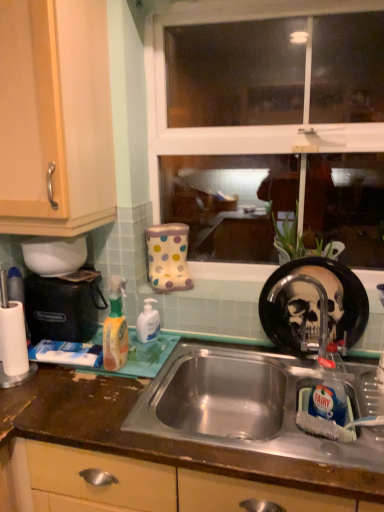
The width and height of the screenshot is (384, 512). Find the location of `brown laminate countertop at center`. brown laminate countertop at center is located at coordinates (177, 442).

What do you see at coordinates (55, 117) in the screenshot?
I see `light wood/finish cabinet at left` at bounding box center [55, 117].

You are a GUI agent. You are given a task and a screenshot of the screen. Output one action in this format:
    pyautogui.click(x=<x>, y=<y>)
    Task: Click on the brown laminate countertop at center
    
    Given the screenshot: What is the action you would take?
    pyautogui.click(x=177, y=442)

In the image, is white matte toothpaste at lower left positioned in front of or behind brown laminate countertop at center?

white matte toothpaste at lower left is positioned farther from the viewer than brown laminate countertop at center.

Between point (99, 364) and point (54, 471), which one is positioned behind?

The point (99, 364) is farther from the camera.

Is white matte toothpaste at lower left at the left side of brown laminate countertop at center?

Yes.

Is white matte toothpaste at lower left not within brown laminate countertop at center?

Absolutely, white matte toothpaste at lower left is external to brown laminate countertop at center.

Is white matte toothpaste at lower left to the left of white glossy hand soap at center, placed as the 2th cleaning product when sorted from front to back, from the viewer's perspective?

Correct, you'll find white matte toothpaste at lower left to the left of white glossy hand soap at center, placed as the 2th cleaning product when sorted from front to back.

Is white matte toothpaste at lower left looking in the opposite direction of white glossy hand soap at center, the first cleaning product from the back?

No.

Which of these two, white matte toothpaste at lower left or white glossy hand soap at center, placed as the second cleaning product when sorted from left to right, is smaller?

Smaller between the two is white glossy hand soap at center, placed as the second cleaning product when sorted from left to right.

Does white matte toothpaste at lower left lie behind white glossy hand soap at center, the first cleaning product from the back?

No, white matte toothpaste at lower left is closer to the viewer.

Is white matte toothpaste at lower left facing towards transparent glass window at center?

No, white matte toothpaste at lower left is not aimed at transparent glass window at center.

Based on the photo, can you confirm if white matte toothpaste at lower left is wider than transparent glass window at center?

Yes, white matte toothpaste at lower left is wider than transparent glass window at center.

Can you confirm if white matte toothpaste at lower left is positioned to the right of transparent glass window at center?

No.

From the image's perspective, between white matte toothpaste at lower left and transparent glass window at center, who is located below?

white matte toothpaste at lower left, from the image's perspective.

Could you measure the distance between translucent orange spray bottle at left, the 1th cleaning product viewed from the front, and brushed metal faucet at sink right?

They are 21.21 inches apart.

Which is closer to the camera, (124,328) or (318,280)?

Point (124,328) is closer to the camera than point (318,280).

From a real-world perspective, is translucent orange spray bottle at left, the second cleaning product in the back-to-front sequence, positioned under brushed metal faucet at sink right based on gravity?

Actually, translucent orange spray bottle at left, the second cleaning product in the back-to-front sequence, is physically above brushed metal faucet at sink right in the real world.

Which object is more forward, translucent orange spray bottle at left, the second cleaning product in the back-to-front sequence, or brushed metal faucet at sink right?

translucent orange spray bottle at left, the second cleaning product in the back-to-front sequence, is more forward.

Is black plastic coffee machine at left wider or thinner than white matte toothpaste at lower left?

black plastic coffee machine at left is thinner than white matte toothpaste at lower left.

Could you tell me if black plastic coffee machine at left is turned towards white matte toothpaste at lower left?

Yes, black plastic coffee machine at left is oriented towards white matte toothpaste at lower left.

Considering the relative positions of black plastic coffee machine at left and white matte toothpaste at lower left in the image provided, is black plastic coffee machine at left to the right of white matte toothpaste at lower left from the viewer's perspective?

No, black plastic coffee machine at left is not to the right of white matte toothpaste at lower left.

Measure the distance between black plastic coffee machine at left and white matte toothpaste at lower left.

They are 4.76 inches apart.

Does brushed metal faucet at sink right come in front of white glossy hand soap at center, placed as the second cleaning product when sorted from left to right?

Yes, brushed metal faucet at sink right is closer to the camera.

Between brushed metal faucet at sink right and white glossy hand soap at center, the first cleaning product from the back, which one has more height?

With more height is brushed metal faucet at sink right.

Can you tell me how much brushed metal faucet at sink right and white glossy hand soap at center, placed as the second cleaning product when sorted from left to right, differ in facing direction?

2.23 degrees separate the facing orientations of brushed metal faucet at sink right and white glossy hand soap at center, placed as the second cleaning product when sorted from left to right.

Considering the relative positions of brushed metal faucet at sink right and white glossy hand soap at center, which is the first cleaning product in right-to-left order, in the image provided, is brushed metal faucet at sink right to the right of white glossy hand soap at center, which is the first cleaning product in right-to-left order, from the viewer's perspective?

Indeed, brushed metal faucet at sink right is positioned on the right side of white glossy hand soap at center, which is the first cleaning product in right-to-left order.

In terms of height, does transparent glass window at center look taller or shorter compared to white matte toothpaste at lower left?

transparent glass window at center is taller than white matte toothpaste at lower left.

Does transparent glass window at center lie in front of white matte toothpaste at lower left?

Yes, it is.

Find the location of a particular element. toothpaste below the transparent glass window at center (from a real-world perspective) is located at coordinates (67, 353).

Image resolution: width=384 pixels, height=512 pixels. What are the coordinates of `toothpaste located above the brown laminate countertop at center (from a real-world perspective)` in the screenshot? It's located at (67, 353).

You are a GUI agent. You are given a task and a screenshot of the screen. Output one action in this format:
    pyautogui.click(x=<x>, y=<y>)
    Task: Click on the cleaning product that is the 1st one when counting upward from the white matte toothpaste at lower left (from the image's perspective)
    Image resolution: width=384 pixels, height=512 pixels.
    Given the screenshot: What is the action you would take?
    pyautogui.click(x=148, y=322)

Estimate the real-world distances between objects in this image. Which object is further from light wood/finish cabinet at left, brushed metal faucet at sink right or black plastic coffee machine at left?

The object further to light wood/finish cabinet at left is brushed metal faucet at sink right.

Based on the photo, looking at the image, which one is located closer to brown laminate countertop at center, white glossy hand soap at center, the first cleaning product from the back, or transparent glass window at center?

white glossy hand soap at center, the first cleaning product from the back.

Looking at the image, which one is located closer to translucent orange spray bottle at left, the second cleaning product in the back-to-front sequence, light wood/finish cabinet at left or transparent glass window at center?

light wood/finish cabinet at left is positioned closer to the anchor translucent orange spray bottle at left, the second cleaning product in the back-to-front sequence.

From the picture: From the image, which object appears to be farther from brown laminate countertop at center, translucent orange spray bottle at left, marked as the first cleaning product in a left-to-right arrangement, or brushed metal faucet at sink right?

Among the two, brushed metal faucet at sink right is located further to brown laminate countertop at center.

Which object lies further to the anchor point transparent glass window at center, light wood/finish cabinet at left or translucent orange spray bottle at left, the second cleaning product when ordered from right to left?

Based on the image, light wood/finish cabinet at left appears to be further to transparent glass window at center.

Considering their positions, is black plastic coffee machine at left positioned further to translucent orange spray bottle at left, the 1th cleaning product viewed from the front, than white matte toothpaste at lower left?

The object further to translucent orange spray bottle at left, the 1th cleaning product viewed from the front, is black plastic coffee machine at left.

Considering their positions, is brushed metal faucet at sink right positioned closer to transparent glass window at center than brown laminate countertop at center?

Based on the image, brushed metal faucet at sink right appears to be nearer to transparent glass window at center.

From the image, which object appears to be farther from transparent glass window at center, brown laminate countertop at center or white glossy hand soap at center, which is the first cleaning product in right-to-left order?

Based on the image, brown laminate countertop at center appears to be further to transparent glass window at center.

This screenshot has width=384, height=512. Find the location of `toothpaste between black plastic coffee machine at left and brushed metal faucet at sink right in the horizontal direction`. toothpaste between black plastic coffee machine at left and brushed metal faucet at sink right in the horizontal direction is located at coordinates (67, 353).

You are a GUI agent. You are given a task and a screenshot of the screen. Output one action in this format:
    pyautogui.click(x=<x>, y=<y>)
    Task: Click on the cleaning product located between black plastic coffee machine at left and white glossy hand soap at center, which is the first cleaning product in right-to-left order, in the left-right direction
    This screenshot has height=512, width=384.
    Given the screenshot: What is the action you would take?
    pyautogui.click(x=115, y=327)

In order to click on countertop situated between black plastic coffee machine at left and brushed metal faucet at sink right from left to right in this screenshot , I will do `click(177, 442)`.

The width and height of the screenshot is (384, 512). Identify the location of tap between transparent glass window at center and brown laminate countertop at center from top to bottom. (319, 298).